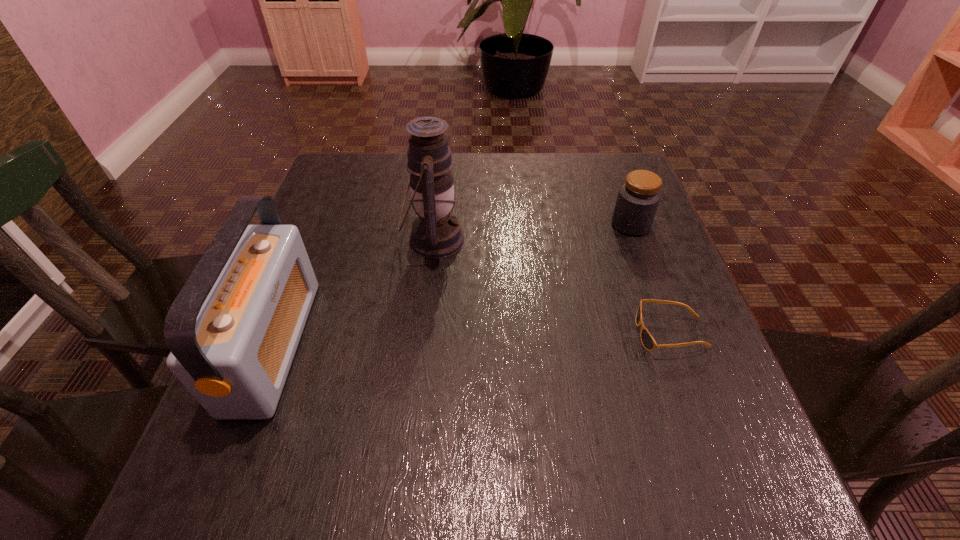
The image size is (960, 540). Identify the location of free point located on the front-facing side of the shortest object. (502, 334).

The height and width of the screenshot is (540, 960). I want to click on free space located on the front-facing side of the shortest object, so click(x=562, y=334).

At what (x,y) coordinates should I click in order to perform the action: click on object positioned at the left edge. Please return your answer as a coordinate pair (x, y). This screenshot has width=960, height=540. Looking at the image, I should click on (233, 330).

Where is `jar present at the right edge`? This screenshot has width=960, height=540. jar present at the right edge is located at coordinates (638, 198).

At what (x,y) coordinates should I click in order to perform the action: click on sunglasses present at the right edge. Please return your answer as a coordinate pair (x, y). Looking at the image, I should click on (648, 342).

You are a GUI agent. You are given a task and a screenshot of the screen. Output one action in this format:
    pyautogui.click(x=<x>, y=<y>)
    Task: Click on the blank space at the far edge of the desktop
    
    Given the screenshot: What is the action you would take?
    pyautogui.click(x=540, y=201)

The height and width of the screenshot is (540, 960). I want to click on vacant space at the left edge of the desktop, so (x=319, y=232).

In the image, there is a desktop. In order to click on vacant space at the right edge in this screenshot , I will do `click(667, 268)`.

In the image, there is a desktop. Identify the location of free space at the far left corner. Image resolution: width=960 pixels, height=540 pixels. (320, 198).

In the image, there is a desktop. At what (x,y) coordinates should I click in order to perform the action: click on free space at the near left corner. Please return your answer as a coordinate pair (x, y). The width and height of the screenshot is (960, 540). Looking at the image, I should click on (197, 464).